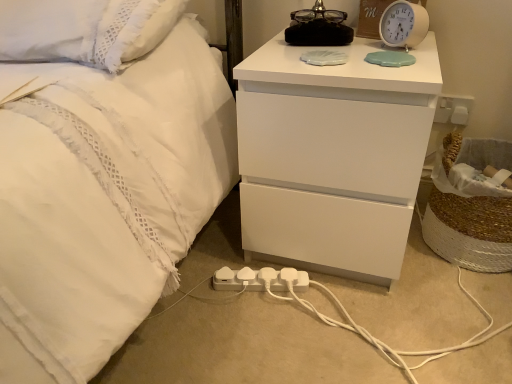
Question: Is white plastic alarm clock at upper right in front of or behind white plastic extension cord at lower center in the image?

Choices:
 (A) front
 (B) behind

Answer: (A)

Question: Is point (406, 33) closer or farther from the camera than point (284, 281)?

Choices:
 (A) farther
 (B) closer

Answer: (B)

Question: Considering the real-world distances, which object is farthest from the white plastic alarm clock at upper right?

Choices:
 (A) white plastic extension cord at lower center
 (B) woven straw laundry basket at lower right
 (C) white matte nightstand at upper right

Answer: (A)

Question: Which is farther from the white matte nightstand at upper right?

Choices:
 (A) white plastic alarm clock at upper right
 (B) white plastic extension cord at lower center
 (C) woven straw laundry basket at lower right

Answer: (C)